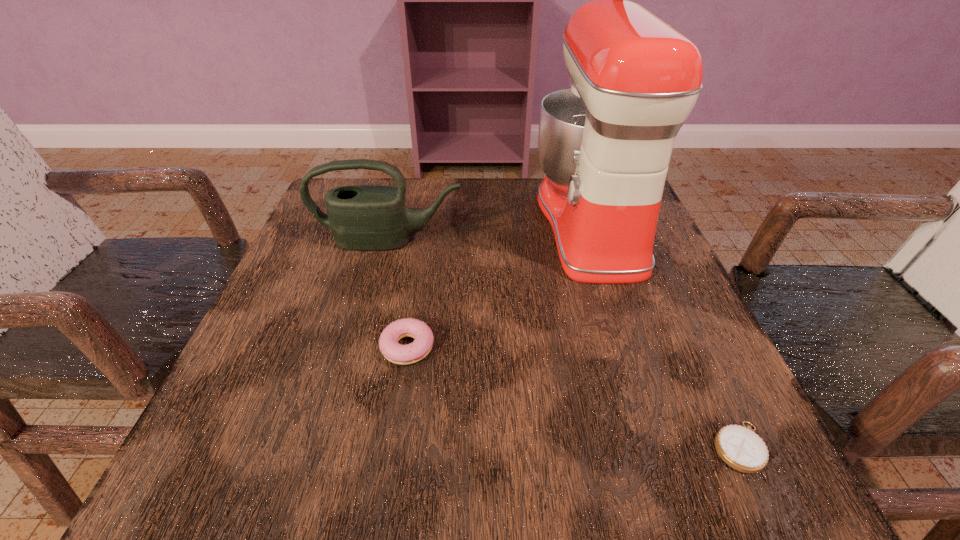
Find the location of a particular element. object present at the near right corner is located at coordinates (740, 447).

Locate an element on the screen. vacant space at the far edge is located at coordinates (499, 183).

Find the location of a particular element. This screenshot has height=540, width=960. vacant space at the near edge of the desktop is located at coordinates tap(482, 484).

You are a GUI agent. You are given a task and a screenshot of the screen. Output one action in this format:
    pyautogui.click(x=<x>, y=<y>)
    Task: Click on the free space at the left edge of the desktop
    
    Given the screenshot: What is the action you would take?
    pyautogui.click(x=350, y=257)

The height and width of the screenshot is (540, 960). In the image, there is a desktop. Find the location of `vacant area at the right edge`. vacant area at the right edge is located at coordinates (600, 297).

Where is `free space at the far left corner of the desktop`? free space at the far left corner of the desktop is located at coordinates (335, 186).

What are the coordinates of `vacant space at the near left corner of the desktop` in the screenshot? It's located at [218, 462].

Find the location of a particular element. The width and height of the screenshot is (960, 540). vacant region between the watering can and the second nearest object is located at coordinates 398,294.

Find the location of a particular element. unoccupied area between the mixer and the doughnut is located at coordinates (499, 285).

Locate an element on the screen. This screenshot has width=960, height=540. free spot between the watering can and the shortest object is located at coordinates (564, 344).